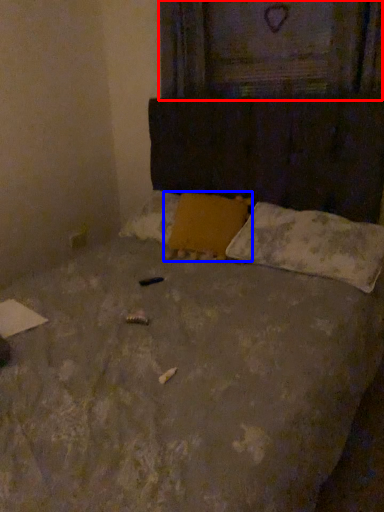
Question: Which point is closer to the camera, window frame (highlighted by a red box) or pillow (highlighted by a blue box)?

Choices:
 (A) window frame
 (B) pillow

Answer: (B)